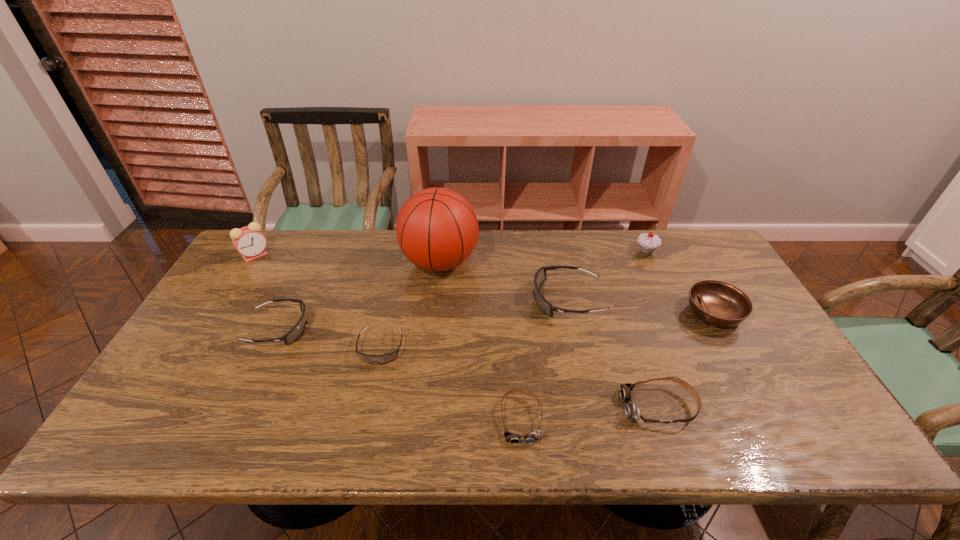
In order to click on blank space located 0.080m on the left of the soup bowl in this screenshot , I will do `click(658, 313)`.

The height and width of the screenshot is (540, 960). In order to click on free location located 0.180m on the lenses of the second smallest black goggles in this screenshot , I will do `click(373, 329)`.

This screenshot has width=960, height=540. Identify the location of vacant region located on the front-facing side of the bigger brown goggles. (453, 407).

Where is `free space located on the front-facing side of the bigger brown goggles`? This screenshot has height=540, width=960. free space located on the front-facing side of the bigger brown goggles is located at coordinates (598, 407).

Where is `vacant area situated on the front-facing side of the bigger brown goggles`? vacant area situated on the front-facing side of the bigger brown goggles is located at coordinates (577, 407).

Find the location of a particular element. This screenshot has width=960, height=540. vacant area situated on the lenses of the smallest black goggles is located at coordinates (364, 428).

Find the location of a particular element. basketball that is at the far edge is located at coordinates [x=437, y=229].

Identify the location of cupcake at the far edge. The image size is (960, 540). [648, 242].

Find the location of a particular element. alarm clock present at the far edge is located at coordinates (249, 241).

You are a GUI agent. You are given a task and a screenshot of the screen. Output one action in this format:
    pyautogui.click(x=<x>, y=<y>)
    Task: Click on the alarm clock that is at the left edge
    
    Given the screenshot: What is the action you would take?
    pyautogui.click(x=249, y=241)